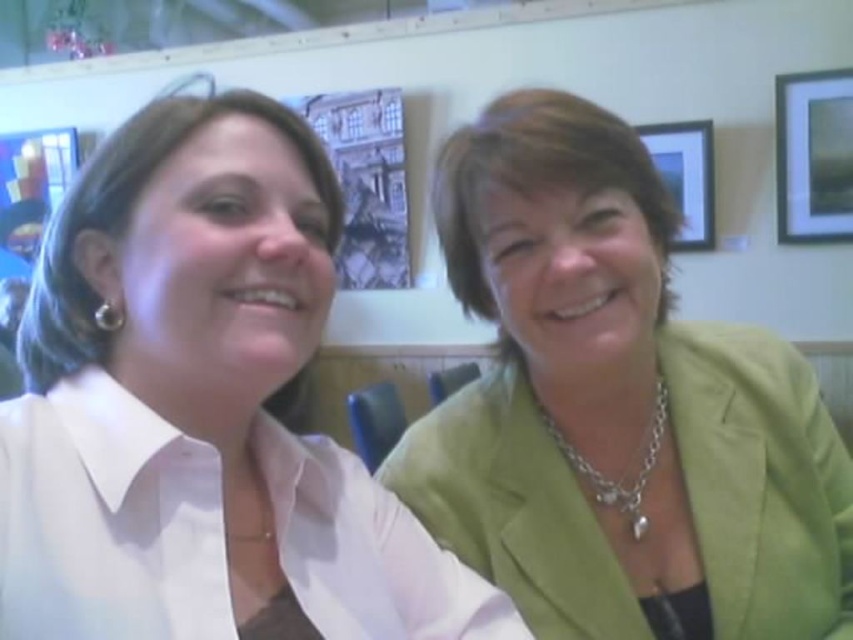
Does matte white blouse at left appear over matte black picture frame at upper right?

Incorrect, matte white blouse at left is not positioned above matte black picture frame at upper right.

Does matte white blouse at left have a smaller size compared to matte black picture frame at upper right?

No.

Is point (349, 504) farther from viewer compared to point (786, 212)?

That is False.

Where is `matte white blouse at left`? Image resolution: width=853 pixels, height=640 pixels. matte white blouse at left is located at coordinates (201, 408).

Which of these two, matte black picture frame at upper right or wooden picture frame at upper right, stands taller?

Standing taller between the two is matte black picture frame at upper right.

Can you confirm if matte black picture frame at upper right is wider than wooden picture frame at upper right?

No, matte black picture frame at upper right is not wider than wooden picture frame at upper right.

The height and width of the screenshot is (640, 853). What do you see at coordinates (813, 156) in the screenshot?
I see `matte black picture frame at upper right` at bounding box center [813, 156].

The height and width of the screenshot is (640, 853). In order to click on matte black picture frame at upper right in this screenshot , I will do `click(813, 156)`.

Is green fabric jacket at right behind wooden picture frame at upper right?

No, green fabric jacket at right is closer to the viewer.

Is green fabric jacket at right shorter than wooden picture frame at upper right?

Correct, green fabric jacket at right is not as tall as wooden picture frame at upper right.

Which is behind, point (770, 612) or point (647, 144)?

The point (647, 144) is behind.

This screenshot has width=853, height=640. I want to click on green fabric jacket at right, so click(618, 406).